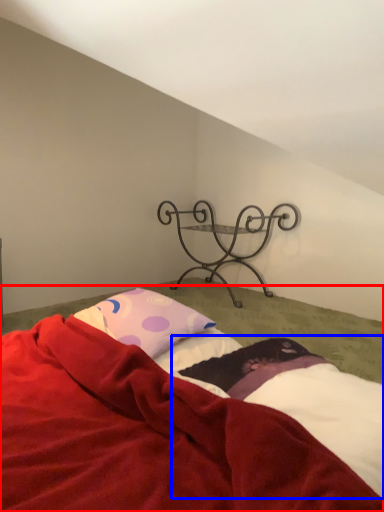
Question: Which object is closer to the camera taking this photo, bed (highlighted by a red box) or sheet (highlighted by a blue box)?

Choices:
 (A) bed
 (B) sheet

Answer: (A)